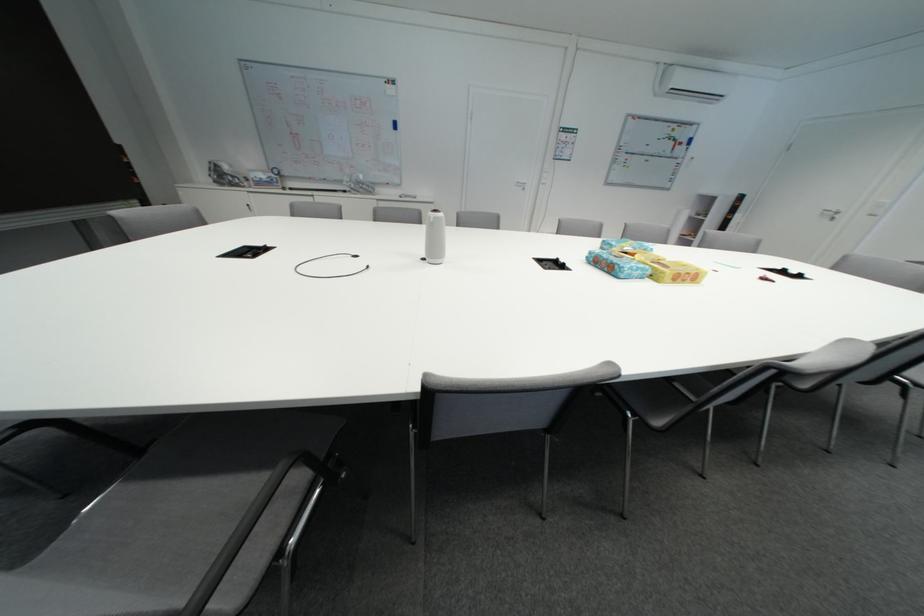
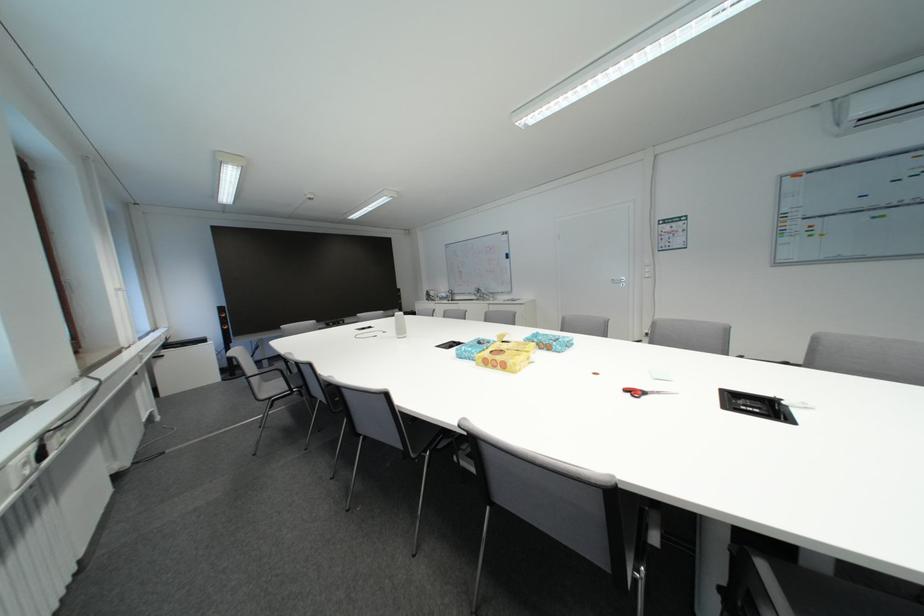
In the second image, find the point that corresponds to pixel 305 137 in the first image.

(470, 275)